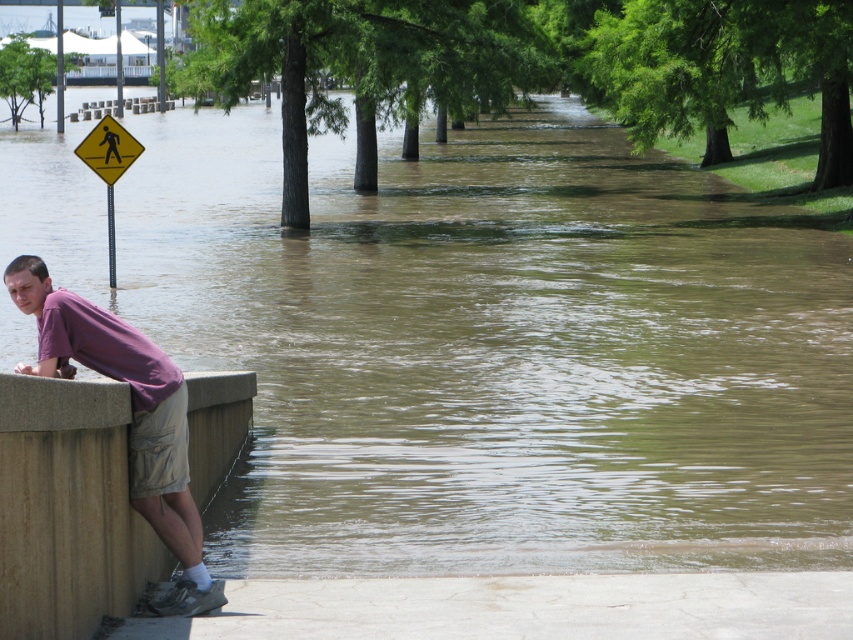
You are standing at the flooded walkway and want to reach a specific point marked at coordinates point (161, 509). Given that the water depth here is 0.5 meters, and your wading ability allows you to safely walk in water up to 0.6 meters deep, can you safely reach that point?

The point (161, 509) is 8.89 meters away from the viewer. Since the water depth is 0.5 meters, which is within your safe wading limit of 0.6 meters, you can safely reach the point as long as you can traverse the distance without obstacles.